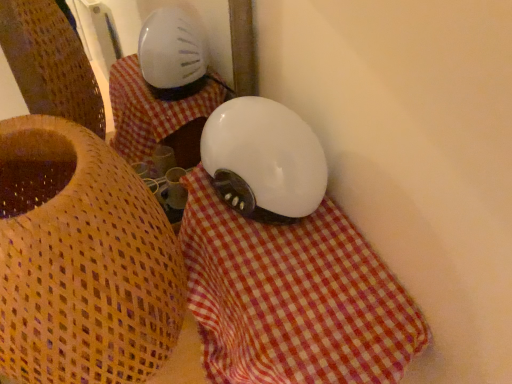
Question: Considering the positions of matte white lampshade at upper center and white glossy helmet at center in the image, is matte white lampshade at upper center taller or shorter than white glossy helmet at center?

Choices:
 (A) short
 (B) tall

Answer: (B)

Question: Would you say matte white lampshade at upper center is to the left or to the right of white glossy helmet at center in the picture?

Choices:
 (A) left
 (B) right

Answer: (A)

Question: Considering the real-world distances, which object is closest to the white checkered cloth at center?

Choices:
 (A) matte white lampshade at upper center
 (B) white glossy helmet at center

Answer: (B)

Question: Estimate the real-world distances between objects in this image. Which object is farther from the white glossy helmet at center?

Choices:
 (A) white checkered cloth at center
 (B) matte white lampshade at upper center

Answer: (B)